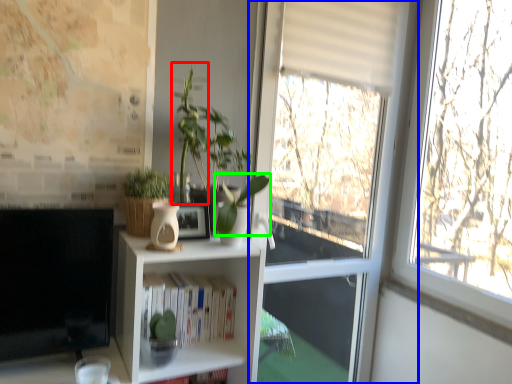
Question: Which object is positioned closest to plant (highlighted by a red box)? Select from window (highlighted by a blue box) and plant (highlighted by a green box).

Choices:
 (A) window
 (B) plant

Answer: (B)